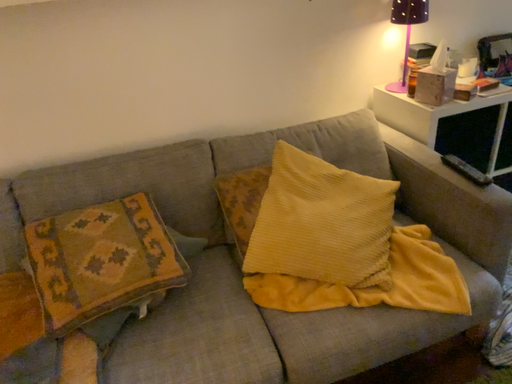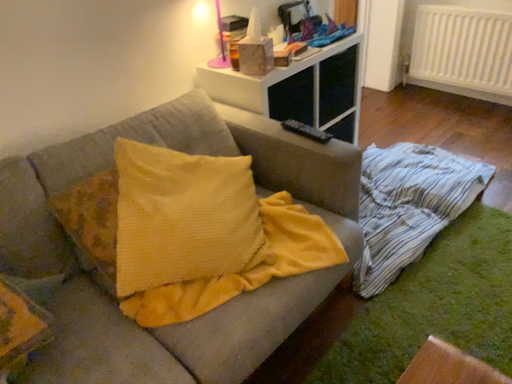
Question: Which way did the camera rotate in the video?

Choices:
 (A) rotated right
 (B) rotated left

Answer: (A)